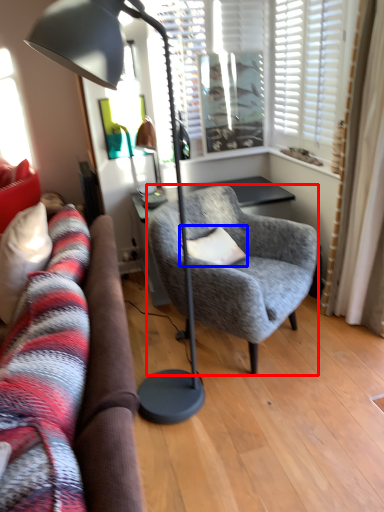
Question: Among these objects, which one is farthest to the camera, chair (highlighted by a red box) or pillow (highlighted by a blue box)?

Choices:
 (A) chair
 (B) pillow

Answer: (B)